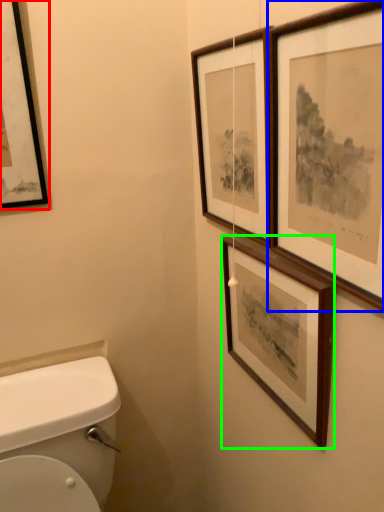
Question: Based on their relative distances, which object is nearer to picture frame (highlighted by a red box)? Choose from picture frame (highlighted by a blue box) and picture frame (highlighted by a green box).

Choices:
 (A) picture frame
 (B) picture frame

Answer: (B)